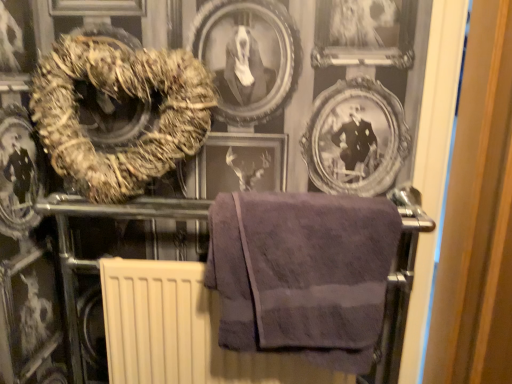
Question: Considering the positions of purple cotton towel at center, marked as the second towel in a left-to-right arrangement, and purple cotton towel at upper left, the 1th towel when ordered from top to bottom, in the image, is purple cotton towel at center, marked as the second towel in a left-to-right arrangement, wider or thinner than purple cotton towel at upper left, the 1th towel when ordered from top to bottom,?

Choices:
 (A) thin
 (B) wide

Answer: (B)

Question: Would you say purple cotton towel at center, marked as the second towel in a left-to-right arrangement, is to the left or to the right of purple cotton towel at upper left, the 1th towel when ordered from top to bottom, in the picture?

Choices:
 (A) right
 (B) left

Answer: (A)

Question: In terms of size, does purple cotton towel at center, which appears as the 1th towel when ordered from the bottom, appear bigger or smaller than purple cotton towel at upper left, positioned as the first towel in left-to-right order?

Choices:
 (A) big
 (B) small

Answer: (B)

Question: Considering their positions, is purple cotton towel at upper left, the 1th towel when ordered from top to bottom, located in front of or behind purple cotton towel at center, marked as the second towel in a left-to-right arrangement?

Choices:
 (A) behind
 (B) front

Answer: (A)

Question: From the image's perspective, is purple cotton towel at upper left, the 2th towel positioned from the right, positioned above or below purple cotton towel at center, which is the 2th towel from top to bottom?

Choices:
 (A) above
 (B) below

Answer: (A)

Question: From their relative heights in the image, would you say purple cotton towel at upper left, positioned as the first towel in left-to-right order, is taller or shorter than purple cotton towel at center, marked as the second towel in a left-to-right arrangement?

Choices:
 (A) short
 (B) tall

Answer: (B)

Question: Does point (156, 62) appear closer or farther from the camera than point (307, 210)?

Choices:
 (A) closer
 (B) farther

Answer: (B)